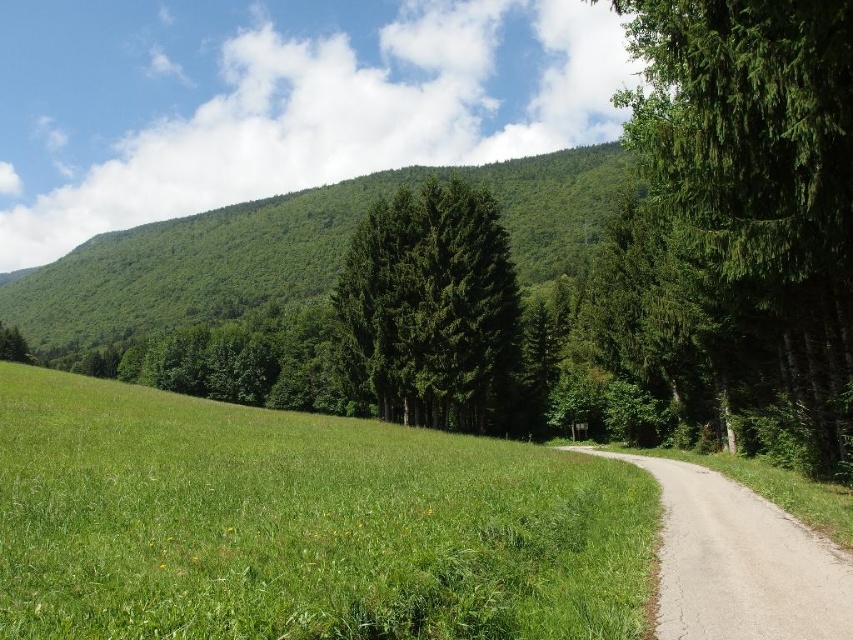
Measure the distance between green grassy field at center and green matte tree at center.

green grassy field at center is 98.20 feet from green matte tree at center.

Does green grassy field at center have a smaller size compared to green matte tree at center?

Correct, green grassy field at center occupies less space than green matte tree at center.

Is point (343, 490) positioned before point (465, 268)?

Yes, point (343, 490) is closer to viewer.

Locate an element on the screen. green grassy field at center is located at coordinates coord(300,524).

Does green leafy hillside at upper left have a smaller size compared to gray gravel path at center-right?

No.

I want to click on green leafy hillside at upper left, so click(293, 250).

Is green textured tree at right below gray gravel path at center-right?

Actually, green textured tree at right is above gray gravel path at center-right.

Between green textured tree at right and gray gravel path at center-right, which one is positioned higher?

green textured tree at right is above.

You are a GUI agent. You are given a task and a screenshot of the screen. Output one action in this format:
    pyautogui.click(x=<x>, y=<y>)
    Task: Click on the green textured tree at right
    Image resolution: width=853 pixels, height=640 pixels.
    Given the screenshot: What is the action you would take?
    pyautogui.click(x=756, y=193)